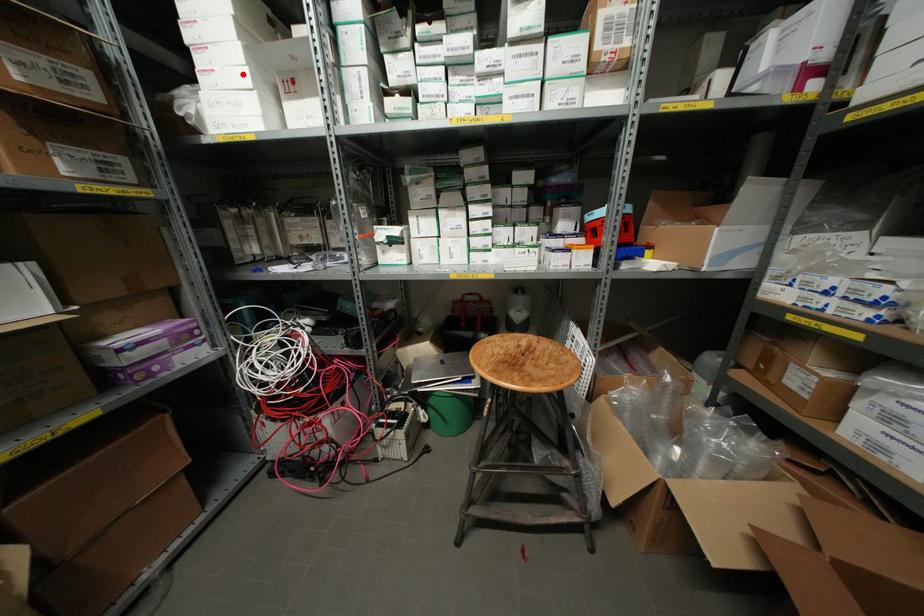
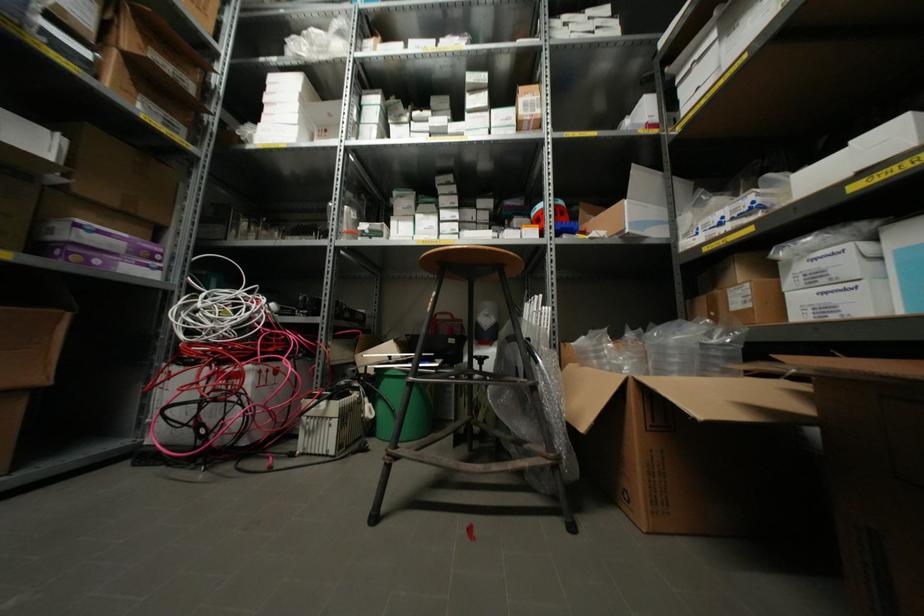
Where in the second image is the point corresponding to the highlighted location from the first image?

(293, 116)